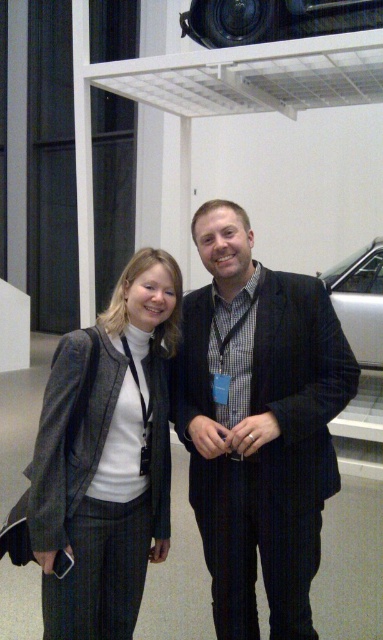
You are a photographer at the event and need to capture a clear photo of the silver metallic car at right without the matte gray blazer at center blocking it. How should you adjust your position?

Move to the side so that the matte gray blazer at center is no longer in front of the silver metallic car at right. Since the matte gray blazer at center is currently in front, shifting your angle will allow you to see the car without obstruction.

You are a photographer standing 1.5 meters away from the matte gray blazer at center. Can you take a clear photo of it without moving closer?

The matte gray blazer at center is 1.44 meters away from the camera, which is within your current distance of 1.5 meters. Therefore, you can take a clear photo without moving closer.